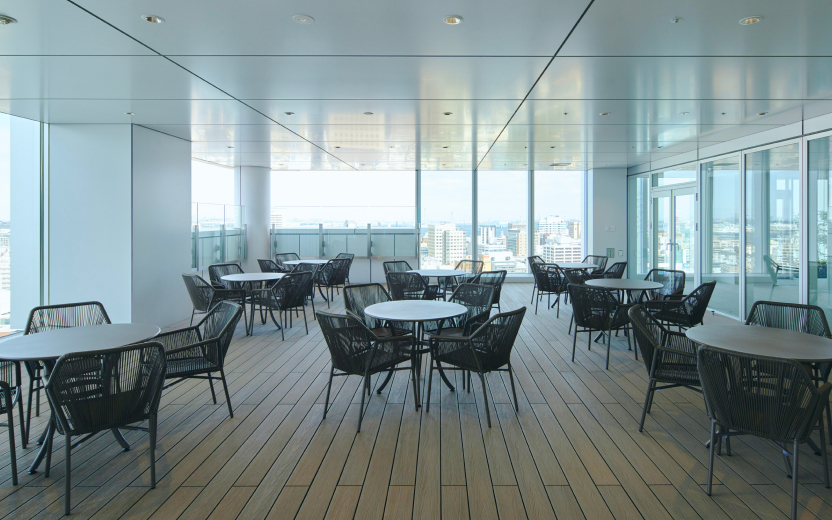
Find the location of a particular element. The height and width of the screenshot is (520, 832). tables is located at coordinates (95, 336), (260, 282), (305, 266), (431, 315), (448, 276), (578, 267), (617, 289), (775, 336).